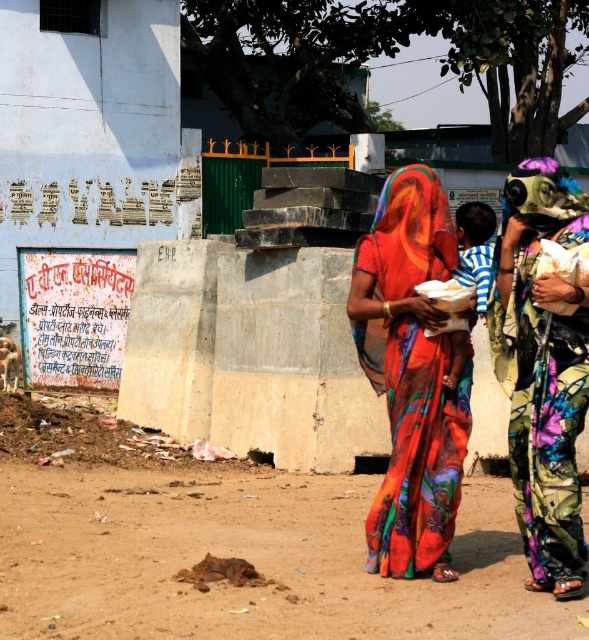
Question: Among these objects, which one is nearest to the camera?

Choices:
 (A) multicolored fabric saree at right
 (B) brown dirt field at lower left

Answer: (A)

Question: Can you confirm if brown dirt field at lower left is smaller than vivid silk saree at center?

Choices:
 (A) yes
 (B) no

Answer: (A)

Question: Which is farther from the vivid silk saree at center?

Choices:
 (A) brown dirt field at lower left
 (B) multicolored fabric saree at right
 (C) striped cotton shirt at center

Answer: (A)

Question: Does multicolored fabric saree at right come in front of striped cotton shirt at center?

Choices:
 (A) yes
 (B) no

Answer: (A)

Question: Among these objects, which one is nearest to the camera?

Choices:
 (A) striped cotton shirt at center
 (B) brown dirt field at lower left
 (C) vivid silk saree at center
 (D) multicolored fabric saree at right

Answer: (D)

Question: Does vivid silk saree at center lie in front of multicolored fabric saree at right?

Choices:
 (A) yes
 (B) no

Answer: (B)